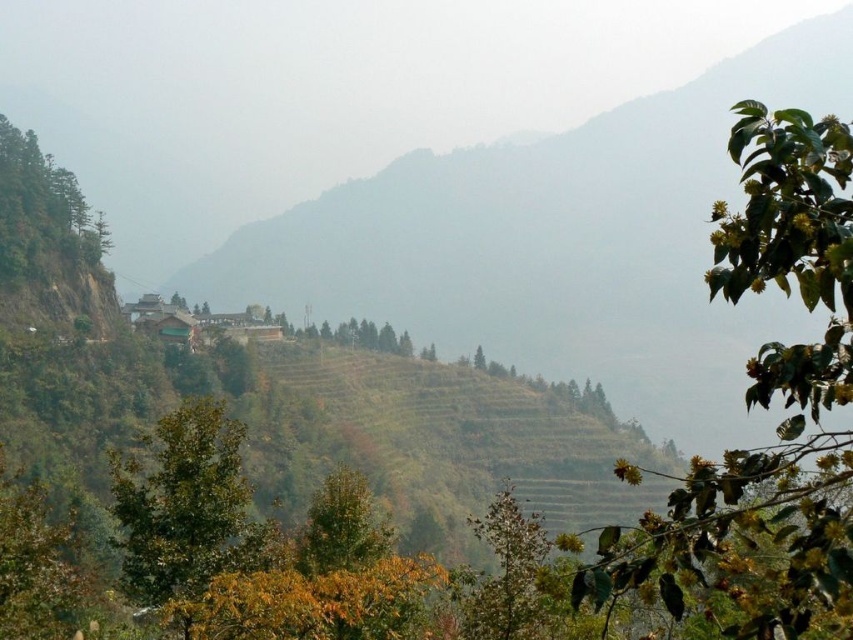
Question: Does green matte tree at lower left have a lesser width compared to green matte tree at upper left?

Choices:
 (A) no
 (B) yes

Answer: (A)

Question: Which point is closer to the camera taking this photo?

Choices:
 (A) (672, 376)
 (B) (370, 499)
 (C) (172, 448)
 (D) (757, 134)

Answer: (D)

Question: Is green leafy tree at upper right thinner than green matte tree at upper left?

Choices:
 (A) no
 (B) yes

Answer: (B)

Question: Which is nearer to the green matte tree at upper left?

Choices:
 (A) green matte tree at lower left
 (B) green leafy tree at upper right

Answer: (A)

Question: Does green leafy tree at upper right come behind green leafy tree at center?

Choices:
 (A) yes
 (B) no

Answer: (B)

Question: Which object is the closest to the green leafy tree at center?

Choices:
 (A) green grassy hillside at center
 (B) green matte tree at center
 (C) green leafy tree at upper right

Answer: (B)